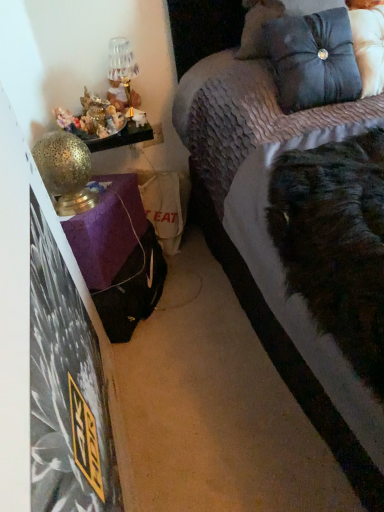
Measure the distance between velvet purple bed at upper right and camera.

A distance of 36.86 inches exists between velvet purple bed at upper right and camera.

The width and height of the screenshot is (384, 512). Describe the element at coordinates (313, 59) in the screenshot. I see `satin blue pillow at upper right` at that location.

Find the location of a particular element. gold textured table lamp at left, arranged as the 2th table lamp when viewed from the top is located at coordinates (66, 172).

Where is `metallic gold table lamp at upper left, which ranks as the 1th table lamp in top-to-bottom order`? The height and width of the screenshot is (512, 384). metallic gold table lamp at upper left, which ranks as the 1th table lamp in top-to-bottom order is located at coordinates (122, 74).

Identify the location of velvet purple bed at upper right. point(287,354).

How far apart are gold textured table lamp at left, which is counted as the first table lamp, starting from the bottom, and satin blue pillow at upper right?

gold textured table lamp at left, which is counted as the first table lamp, starting from the bottom, is 28.47 inches away from satin blue pillow at upper right.

Would you say satin blue pillow at upper right is part of gold textured table lamp at left, which is counted as the first table lamp, starting from the bottom,'s contents?

No, satin blue pillow at upper right is not surrounded by gold textured table lamp at left, which is counted as the first table lamp, starting from the bottom.

Between gold textured table lamp at left, which appears as the 1th table lamp when viewed from the front, and satin blue pillow at upper right, which one has smaller size?

gold textured table lamp at left, which appears as the 1th table lamp when viewed from the front, is smaller.

What's the angular difference between gold textured table lamp at left, arranged as the 2th table lamp when viewed from the top, and satin blue pillow at upper right's facing directions?

The angular difference between gold textured table lamp at left, arranged as the 2th table lamp when viewed from the top, and satin blue pillow at upper right is 1.85 degrees.

Is point (339, 74) farther from viewer compared to point (127, 96)?

No, it is not.

Considering the positions of objects satin blue pillow at upper right and metallic gold table lamp at upper left, which ranks as the 1th table lamp in top-to-bottom order, in the image provided, who is more to the right, satin blue pillow at upper right or metallic gold table lamp at upper left, which ranks as the 1th table lamp in top-to-bottom order,?

Positioned to the right is satin blue pillow at upper right.

Is satin blue pillow at upper right taller than metallic gold table lamp at upper left, which ranks as the 1th table lamp in top-to-bottom order?

Indeed, satin blue pillow at upper right has a greater height compared to metallic gold table lamp at upper left, which ranks as the 1th table lamp in top-to-bottom order.

From the image's perspective, between shiny metallic figurines at left and velvet purple bed at upper right, who is located below?

velvet purple bed at upper right.

Are shiny metallic figurines at left and velvet purple bed at upper right located far from each other?

shiny metallic figurines at left is near velvet purple bed at upper right, not far away.

How many degrees apart are the facing directions of shiny metallic figurines at left and velvet purple bed at upper right?

The facing directions of shiny metallic figurines at left and velvet purple bed at upper right are 23.2 degrees apart.

From a real-world perspective, is shiny metallic figurines at left positioned above or below velvet purple bed at upper right?

Clearly, from a real-world perspective, shiny metallic figurines at left is above velvet purple bed at upper right.

Is shiny metallic figurines at left taller or shorter than satin blue pillow at upper right?

shiny metallic figurines at left is shorter than satin blue pillow at upper right.

In the image, is shiny metallic figurines at left positioned in front of or behind satin blue pillow at upper right?

shiny metallic figurines at left is positioned farther from the viewer than satin blue pillow at upper right.

Who is bigger, shiny metallic figurines at left or satin blue pillow at upper right?

satin blue pillow at upper right is bigger.

Considering the points (67, 200) and (91, 102), which point is behind, point (67, 200) or point (91, 102)?

The point (91, 102) is farther from the camera.

Considering the sizes of objects gold textured table lamp at left, which appears as the 1th table lamp when viewed from the front, and shiny metallic figurines at left in the image provided, who is taller, gold textured table lamp at left, which appears as the 1th table lamp when viewed from the front, or shiny metallic figurines at left?

With more height is gold textured table lamp at left, which appears as the 1th table lamp when viewed from the front.

Measure the distance between gold textured table lamp at left, which is counted as the first table lamp, starting from the bottom, and shiny metallic figurines at left.

gold textured table lamp at left, which is counted as the first table lamp, starting from the bottom, and shiny metallic figurines at left are 7.55 inches apart from each other.

Find the location of a particular element. stuff lying above the gold textured table lamp at left, arranged as the 2th table lamp when viewed from the top (from the image's perspective) is located at coordinates (92, 118).

Considering the positions of objects metallic gold table lamp at upper left, arranged as the second table lamp when viewed from the front, and shiny metallic figurines at left in the image provided, who is more to the left, metallic gold table lamp at upper left, arranged as the second table lamp when viewed from the front, or shiny metallic figurines at left?

shiny metallic figurines at left.

Can you confirm if metallic gold table lamp at upper left, which ranks as the 1th table lamp in top-to-bottom order, is smaller than shiny metallic figurines at left?

Indeed, metallic gold table lamp at upper left, which ranks as the 1th table lamp in top-to-bottom order, has a smaller size compared to shiny metallic figurines at left.

How distant is metallic gold table lamp at upper left, which is the 2th table lamp from bottom to top, from shiny metallic figurines at left?

metallic gold table lamp at upper left, which is the 2th table lamp from bottom to top, and shiny metallic figurines at left are 11.72 centimeters apart.

Where is `stuff that is in front of the metallic gold table lamp at upper left, which ranks as the 1th table lamp in top-to-bottom order`? stuff that is in front of the metallic gold table lamp at upper left, which ranks as the 1th table lamp in top-to-bottom order is located at coordinates (92, 118).

Can you confirm if gold textured table lamp at left, positioned as the 2th table lamp in back-to-front order, is positioned to the right of metallic gold table lamp at upper left, which ranks as the 1th table lamp in top-to-bottom order?

In fact, gold textured table lamp at left, positioned as the 2th table lamp in back-to-front order, is to the left of metallic gold table lamp at upper left, which ranks as the 1th table lamp in top-to-bottom order.

Looking at this image, which is correct: gold textured table lamp at left, which appears as the 1th table lamp when viewed from the front, is inside metallic gold table lamp at upper left, arranged as the first table lamp when viewed from the back, or outside of it?

gold textured table lamp at left, which appears as the 1th table lamp when viewed from the front, is spatially situated outside metallic gold table lamp at upper left, arranged as the first table lamp when viewed from the back.

You are a GUI agent. You are given a task and a screenshot of the screen. Output one action in this format:
    pyautogui.click(x=<x>, y=<y>)
    Task: Click on the table lamp that appears above the gold textured table lamp at left, arranged as the 2th table lamp when viewed from the top (from the image's perspective)
    
    Given the screenshot: What is the action you would take?
    pyautogui.click(x=122, y=74)

The image size is (384, 512). In order to click on pillow above the gold textured table lamp at left, which appears as the 1th table lamp when viewed from the front (from a real-world perspective) in this screenshot , I will do `click(313, 59)`.

Identify the location of pillow located on the right of metallic gold table lamp at upper left, arranged as the second table lamp when viewed from the front. The height and width of the screenshot is (512, 384). (313, 59).

From the image, which object appears to be nearer to metallic gold table lamp at upper left, which ranks as the 1th table lamp in top-to-bottom order, satin blue pillow at upper right or velvet purple bed at upper right?

Among the two, satin blue pillow at upper right is located nearer to metallic gold table lamp at upper left, which ranks as the 1th table lamp in top-to-bottom order.

From the image, which object appears to be farther from satin blue pillow at upper right, shiny metallic figurines at left or gold textured table lamp at left, which is counted as the first table lamp, starting from the bottom?

The object further to satin blue pillow at upper right is gold textured table lamp at left, which is counted as the first table lamp, starting from the bottom.

In the scene shown: When comparing their distances from velvet purple bed at upper right, does gold textured table lamp at left, which appears as the 1th table lamp when viewed from the front, or metallic gold table lamp at upper left, which ranks as the 1th table lamp in top-to-bottom order, seem closer?

gold textured table lamp at left, which appears as the 1th table lamp when viewed from the front.

Estimate the real-world distances between objects in this image. Which object is further from shiny metallic figurines at left, velvet purple bed at upper right or metallic gold table lamp at upper left, which is the 2th table lamp from bottom to top?

The object further to shiny metallic figurines at left is velvet purple bed at upper right.

Which object lies nearer to the anchor point gold textured table lamp at left, arranged as the 2th table lamp when viewed from the top, shiny metallic figurines at left or satin blue pillow at upper right?

shiny metallic figurines at left.

Based on their spatial positions, is gold textured table lamp at left, positioned as the 2th table lamp in back-to-front order, or velvet purple bed at upper right further from shiny metallic figurines at left?

Based on the image, velvet purple bed at upper right appears to be further to shiny metallic figurines at left.

Looking at the image, which one is located further to shiny metallic figurines at left, velvet purple bed at upper right or gold textured table lamp at left, which appears as the 1th table lamp when viewed from the front?

Among the two, velvet purple bed at upper right is located further to shiny metallic figurines at left.

Based on the photo, estimate the real-world distances between objects in this image. Which object is closer to gold textured table lamp at left, positioned as the 2th table lamp in back-to-front order, shiny metallic figurines at left or velvet purple bed at upper right?

shiny metallic figurines at left.

Identify the location of table lamp situated between gold textured table lamp at left, arranged as the 2th table lamp when viewed from the top, and satin blue pillow at upper right from left to right. (122, 74).

What are the coordinates of `stuff located between velvet purple bed at upper right and metallic gold table lamp at upper left, which is the 2th table lamp from bottom to top, in the depth direction` in the screenshot? It's located at (92, 118).

At what (x,y) coordinates should I click in order to perform the action: click on table lamp located between velvet purple bed at upper right and shiny metallic figurines at left in the depth direction. Please return your answer as a coordinate pair (x, y). This screenshot has width=384, height=512. Looking at the image, I should click on (66, 172).

The height and width of the screenshot is (512, 384). I want to click on stuff between metallic gold table lamp at upper left, arranged as the second table lamp when viewed from the front, and gold textured table lamp at left, which is counted as the first table lamp, starting from the bottom, in the up-down direction, so click(x=92, y=118).